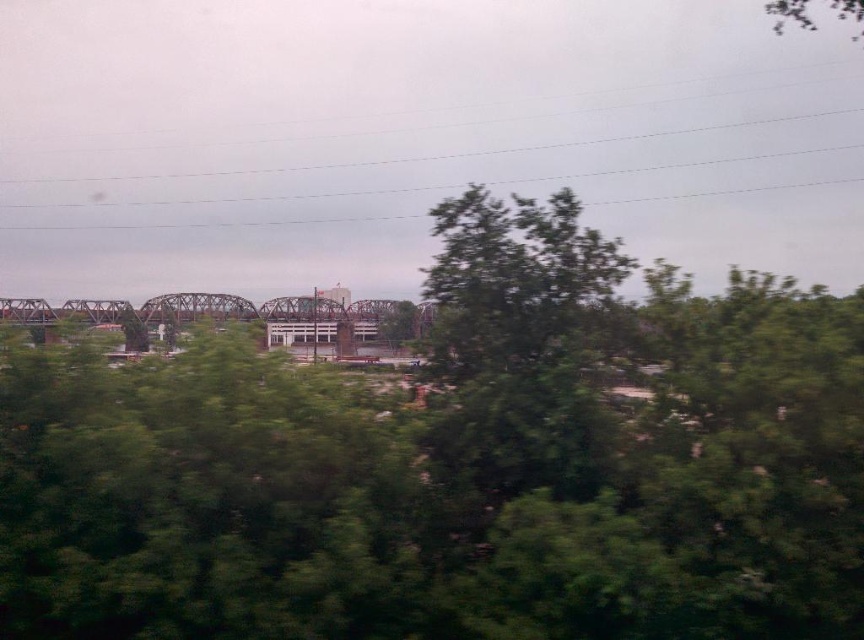
Question: Is green leafy tree at center wider than green leafy tree at upper center?

Choices:
 (A) no
 (B) yes

Answer: (B)

Question: Which object is the closest to the green leafy tree at upper center?

Choices:
 (A) green leafy tree at center
 (B) metallic gray bridge at center

Answer: (B)

Question: Can you confirm if metallic gray bridge at center is positioned to the left of green leafy tree at upper center?

Choices:
 (A) no
 (B) yes

Answer: (B)

Question: Does green leafy tree at center appear on the left side of metallic gray bridge at center?

Choices:
 (A) no
 (B) yes

Answer: (A)

Question: Which object appears farthest from the camera in this image?

Choices:
 (A) green leafy tree at center
 (B) green leafy tree at upper center
 (C) metallic gray bridge at center

Answer: (B)

Question: Which object is farther from the camera taking this photo?

Choices:
 (A) metallic gray bridge at center
 (B) green leafy tree at upper center

Answer: (B)